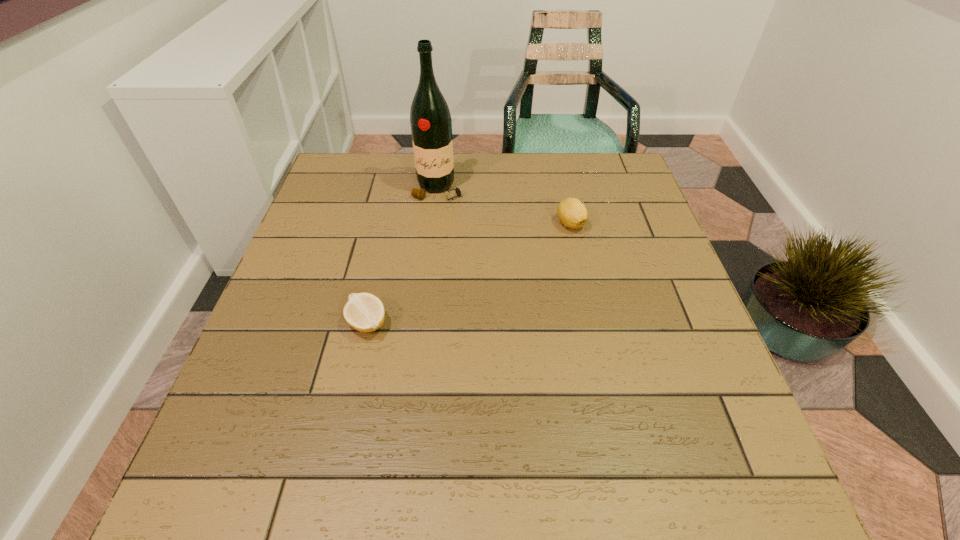
Identify the location of the farthest object. Image resolution: width=960 pixels, height=540 pixels. (431, 126).

In order to click on the tallest object in this screenshot , I will do `click(431, 126)`.

Identify the location of the farther lemon. The image size is (960, 540). (572, 213).

Find the location of `the right lemon`. the right lemon is located at coordinates (572, 213).

Locate an element on the screen. The width and height of the screenshot is (960, 540). the nearer lemon is located at coordinates (364, 312).

Locate an element on the screen. the nearest object is located at coordinates (364, 312).

You are a GUI agent. You are given a task and a screenshot of the screen. Output one action in this format:
    pyautogui.click(x=<x>, y=<y>)
    Task: Click on the vacant space located 0.180m on the surface of the wine bottle
    This screenshot has width=960, height=540.
    Given the screenshot: What is the action you would take?
    pyautogui.click(x=431, y=249)

At what (x,y) coordinates should I click in order to perform the action: click on vacant space located at the stem end of the rightmost object. Please return your answer as a coordinate pair (x, y). This screenshot has height=540, width=960. Looking at the image, I should click on (576, 249).

Image resolution: width=960 pixels, height=540 pixels. In order to click on blank area located 0.160m on the left of the shortest object in this screenshot , I will do `click(270, 323)`.

This screenshot has height=540, width=960. I want to click on object that is at the far edge, so click(431, 126).